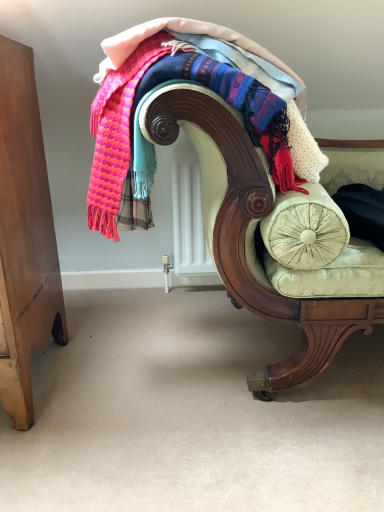
Question: From the image's perspective, does velvet green chaise at center appear lower than knitted wool scarf at upper center?

Choices:
 (A) yes
 (B) no

Answer: (A)

Question: Is knitted wool scarf at upper center at the back of velvet green chaise at center?

Choices:
 (A) yes
 (B) no

Answer: (B)

Question: Is velvet green chaise at center to the right of knitted wool scarf at upper center from the viewer's perspective?

Choices:
 (A) yes
 (B) no

Answer: (A)

Question: Considering the relative sizes of velvet green chaise at center and knitted wool scarf at upper center in the image provided, is velvet green chaise at center shorter than knitted wool scarf at upper center?

Choices:
 (A) yes
 (B) no

Answer: (B)

Question: From a real-world perspective, is velvet green chaise at center positioned under knitted wool scarf at upper center based on gravity?

Choices:
 (A) no
 (B) yes

Answer: (B)

Question: Is velvet green chaise at center far from knitted wool scarf at upper center?

Choices:
 (A) yes
 (B) no

Answer: (B)

Question: From the image's perspective, is knitted wool scarf at upper center above velvet green chaise at center?

Choices:
 (A) no
 (B) yes

Answer: (B)

Question: Can you confirm if knitted wool scarf at upper center is taller than velvet green chaise at center?

Choices:
 (A) no
 (B) yes

Answer: (A)

Question: Could velvet green chaise at center be considered to be inside knitted wool scarf at upper center?

Choices:
 (A) no
 (B) yes

Answer: (A)

Question: Is the surface of knitted wool scarf at upper center in direct contact with velvet green chaise at center?

Choices:
 (A) yes
 (B) no

Answer: (B)

Question: Considering the relative sizes of knitted wool scarf at upper center and velvet green chaise at center in the image provided, is knitted wool scarf at upper center smaller than velvet green chaise at center?

Choices:
 (A) no
 (B) yes

Answer: (B)

Question: Is knitted wool scarf at upper center positioned in front of velvet green chaise at center?

Choices:
 (A) yes
 (B) no

Answer: (B)

Question: From a real-world perspective, is knitted wool scarf at upper center above or below velvet green chaise at center?

Choices:
 (A) above
 (B) below

Answer: (A)